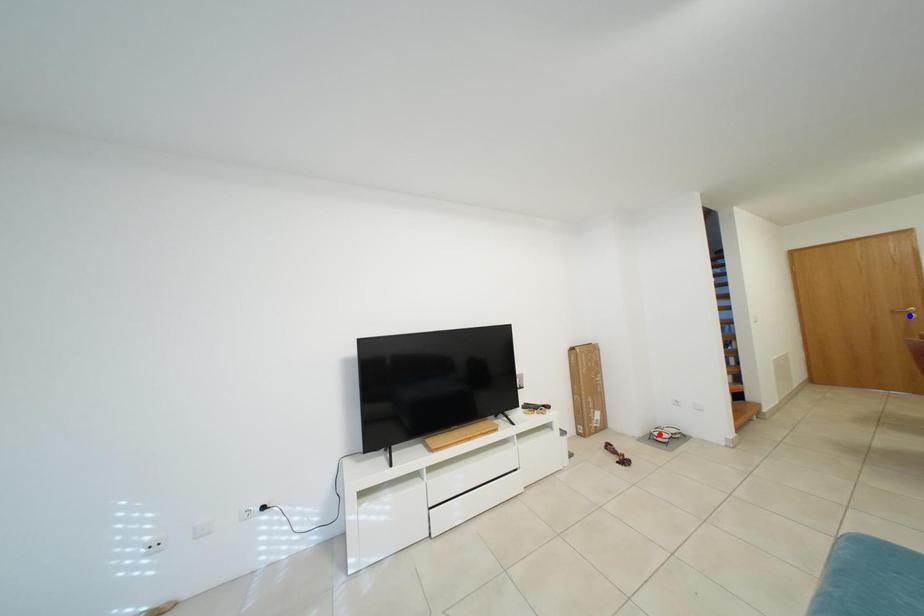
Question: Two points are marked on the image. Which point is closer to the camera?

Choices:
 (A) Blue point is closer.
 (B) Red point is closer.

Answer: (A)